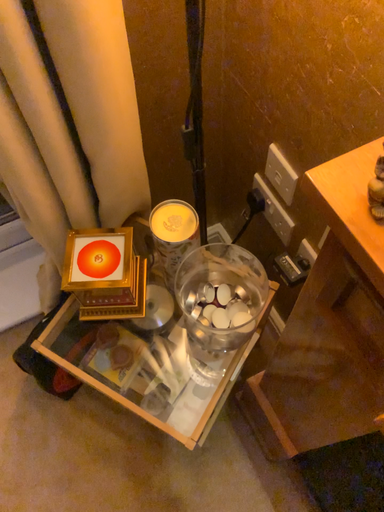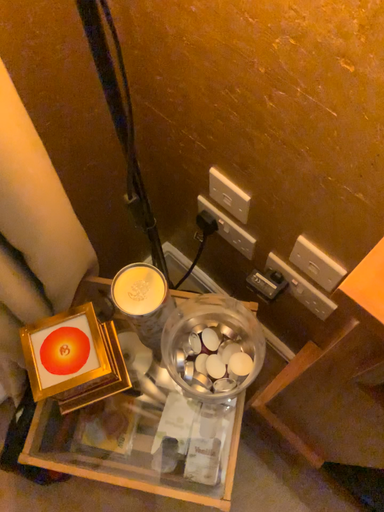
Question: How did the camera likely rotate when shooting the video?

Choices:
 (A) rotated right
 (B) rotated left

Answer: (A)